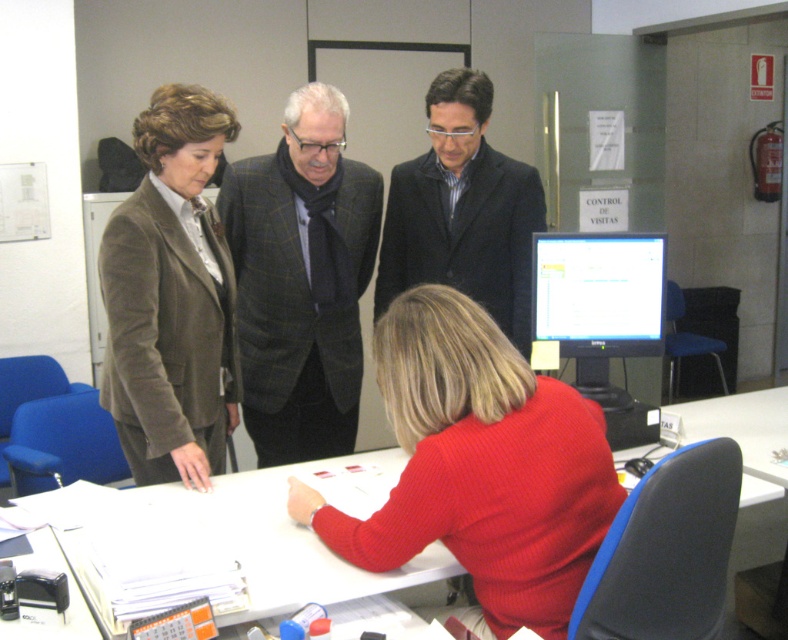
You are an office manager trying to arrange blazers on a rack. The plaid wool blazer at center and the brown velvety blazer at left are available. Given their sizes, which one should you place on the higher hanger?

The plaid wool blazer at center is much taller than the brown velvety blazer at left, so it should be placed on the higher hanger to accommodate its size.

Consider the image. You are a delivery robot that is 1.2 meters tall. You are positioned in front of the white glossy table at lower center. Can you reach the top of the table without any assistance?

The white glossy table at lower center is 1.46 meters away from the camera, but the question is about height, not distance. Since the robot is 1.2 meters tall, it cannot reach the top of the table unless the table is lower than or equal to its height. However, the provided information does not specify the table height, so we cannot determine reachability based on the given data.

From the picture: Based on the scene description, which object is positioned lower in the image, the white glossy table at lower center or the black woolen suit at center?

The white glossy table at lower center is positioned lower in the image than the black woolen suit at center according to the description.